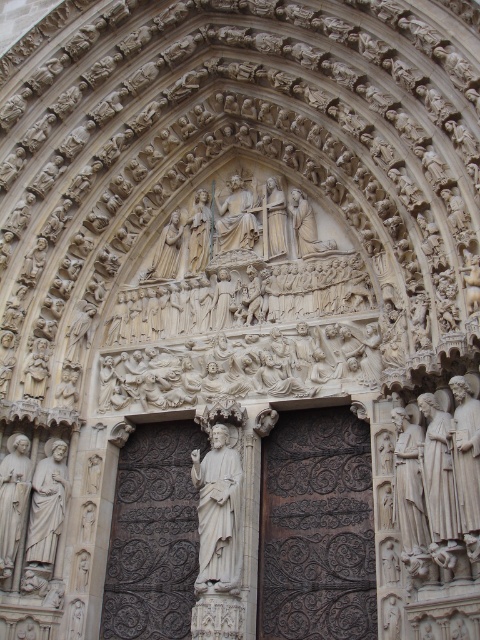
Question: Which object appears farthest from the camera in this image?

Choices:
 (A) white marble statue at lower left
 (B) polished stone statue at center

Answer: (B)

Question: Which of the following is the closest to the observer?

Choices:
 (A) white marble statue at center
 (B) polished stone statue at center

Answer: (A)

Question: Can you confirm if white marble statue at center is thinner than white marble statue at lower left?

Choices:
 (A) no
 (B) yes

Answer: (A)

Question: Does dark brown wood at center have a greater width compared to polished stone statue at center?

Choices:
 (A) no
 (B) yes

Answer: (B)

Question: Considering the relative positions of white marble statue at lower left and polished stone statue at center in the image provided, where is white marble statue at lower left located with respect to polished stone statue at center?

Choices:
 (A) above
 (B) below

Answer: (B)

Question: Among these points, which one is farthest from the camera?

Choices:
 (A) (230, 508)
 (B) (347, 534)

Answer: (B)